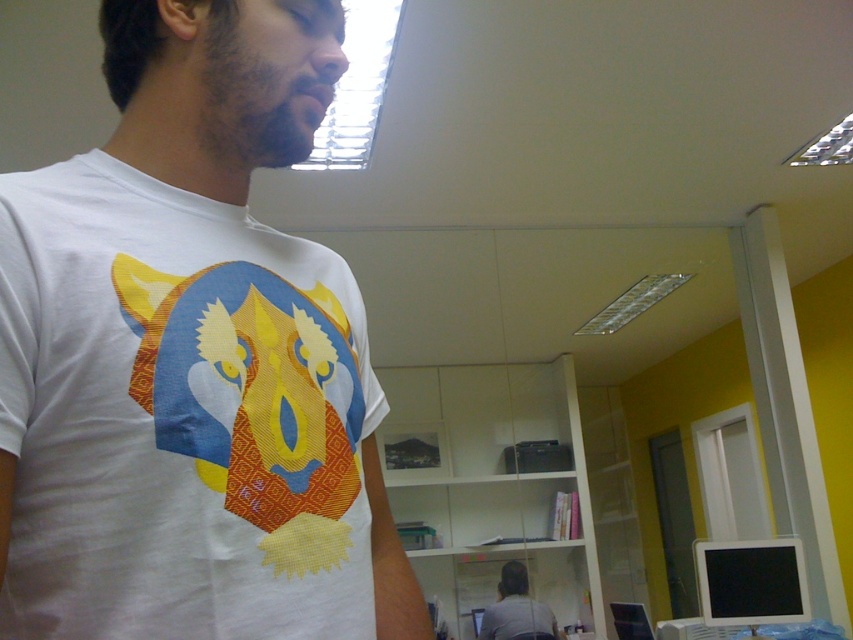
Can you confirm if white matte t-shirt at center is thinner than white t-shirt at center?

Yes, white matte t-shirt at center is thinner than white t-shirt at center.

Does white matte t-shirt at center have a larger size compared to white t-shirt at center?

Incorrect, white matte t-shirt at center is not larger than white t-shirt at center.

Where is `white matte t-shirt at center`? white matte t-shirt at center is located at coordinates (190, 358).

You are a GUI agent. You are given a task and a screenshot of the screen. Output one action in this format:
    pyautogui.click(x=<x>, y=<y>)
    Task: Click on the white matte t-shirt at center
    
    Given the screenshot: What is the action you would take?
    pyautogui.click(x=190, y=358)